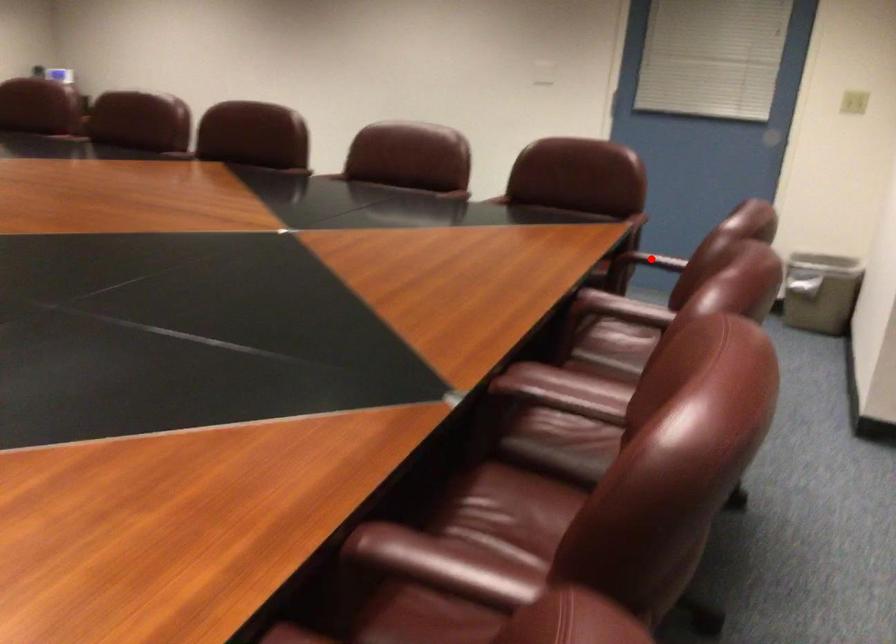
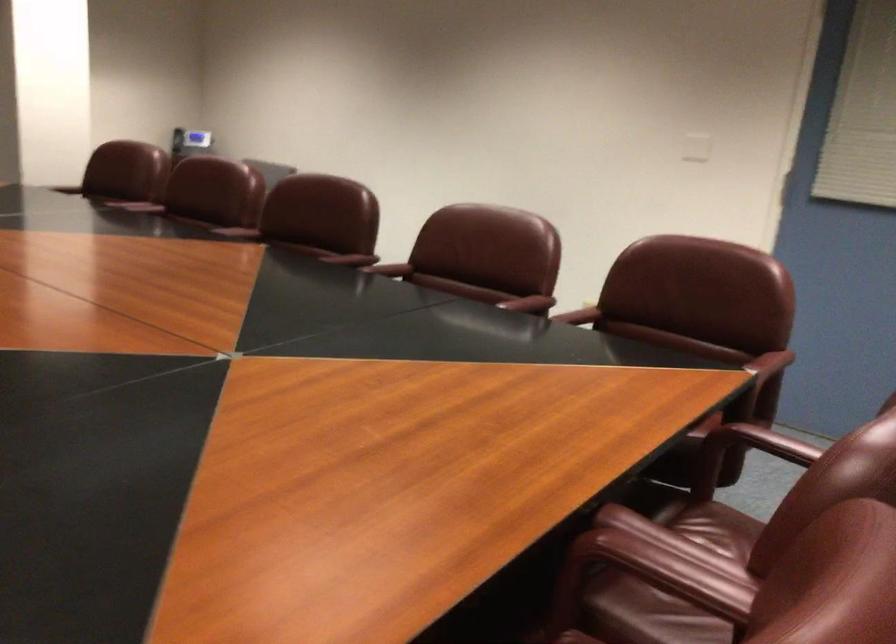
In the second image, find the point that corresponds to the highlighted location in the first image.

(761, 442)